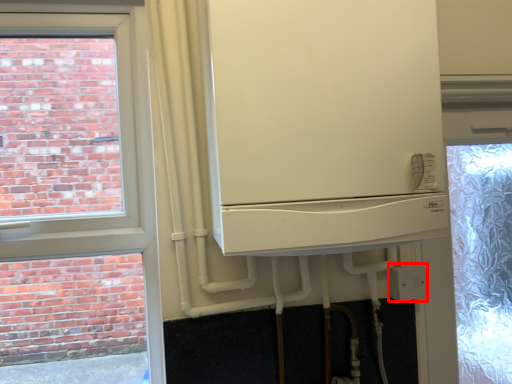
Question: Observing the image, what is the correct spatial positioning of electric outlet (annotated by the red box) in reference to fridge?

Choices:
 (A) left
 (B) right

Answer: (B)